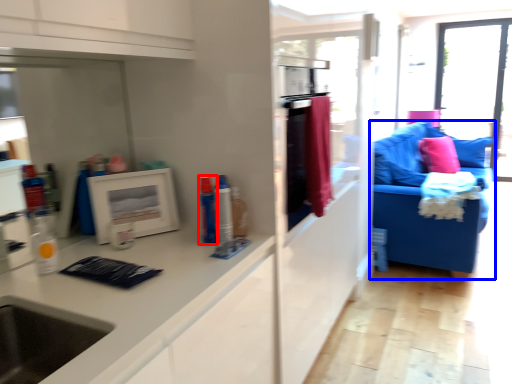
Question: Which object appears closest to the camera in this image, toiletry (highlighted by a red box) or studio couch (highlighted by a blue box)?

Choices:
 (A) toiletry
 (B) studio couch

Answer: (A)